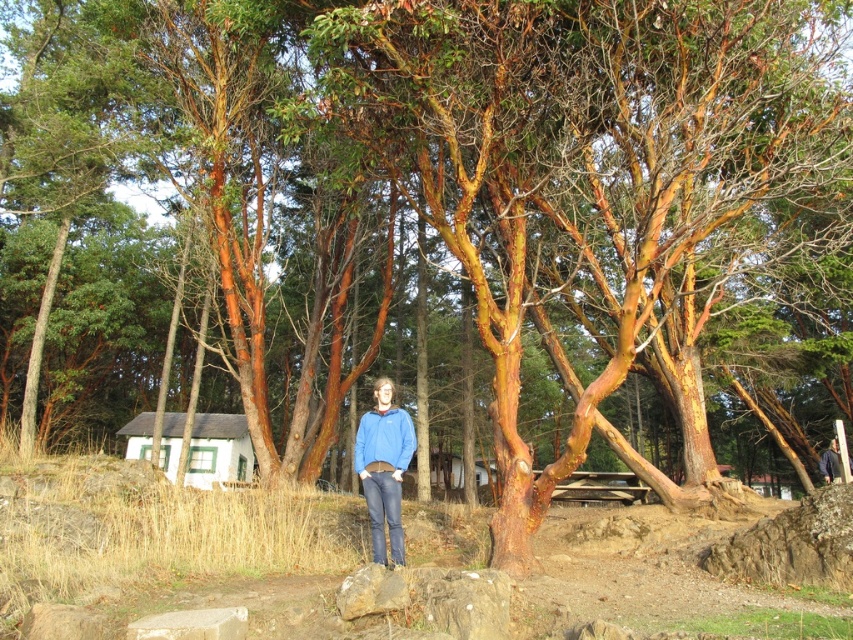
Question: Which object is the closest to the brown rough rock at center?

Choices:
 (A) blue fleece jacket at center
 (B) blue fabric jacket at center
 (C) matte blue sweatshirt at center
 (D) smooth gray rock at lower center

Answer: (D)

Question: In this image, where is smooth gray rock at lower center located relative to brown rough rock at center?

Choices:
 (A) right
 (B) left

Answer: (A)

Question: Does matte blue sweatshirt at center lie in front of brown rough rock at center?

Choices:
 (A) no
 (B) yes

Answer: (A)

Question: Which object is farther from the camera taking this photo?

Choices:
 (A) smooth gray stone at lower center
 (B) blue fabric jacket at center
 (C) smooth gray rock at lower center
 (D) matte blue sweatshirt at center

Answer: (B)

Question: Which of the following is the closest to the observer?

Choices:
 (A) (384, 452)
 (B) (837, 468)
 (C) (386, 449)

Answer: (A)

Question: Observing the image, what is the correct spatial positioning of matte blue sweatshirt at center in reference to blue fabric jacket at center?

Choices:
 (A) below
 (B) above

Answer: (B)